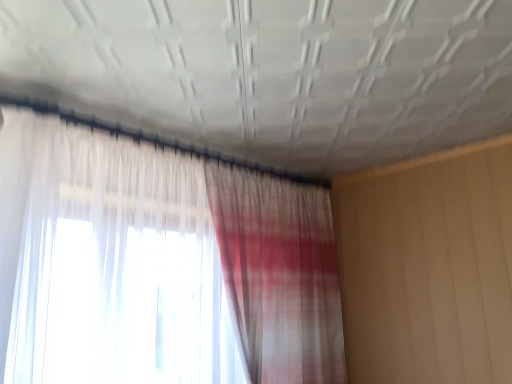
What do you see at coordinates (158, 266) in the screenshot? I see `translucent fabric curtain at upper center` at bounding box center [158, 266].

You are a GUI agent. You are given a task and a screenshot of the screen. Output one action in this format:
    pyautogui.click(x=<x>, y=<y>)
    Task: Click on the translucent fabric curtain at upper center
    This screenshot has width=512, height=384.
    Given the screenshot: What is the action you would take?
    pyautogui.click(x=158, y=266)

I want to click on translucent fabric curtain at upper center, so (158, 266).